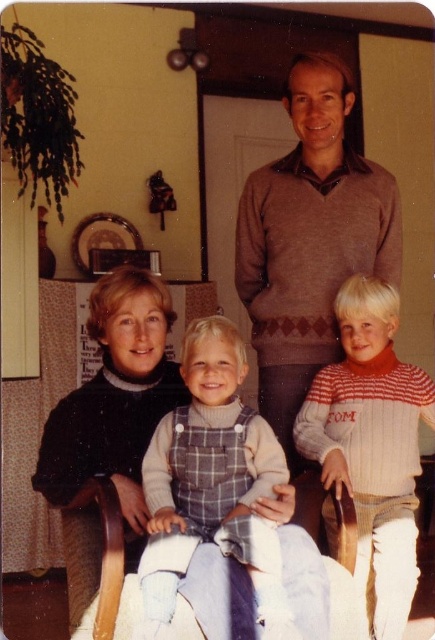
Is brown sweater at center below plaid denim overalls at center?

Incorrect, brown sweater at center is not positioned below plaid denim overalls at center.

Is brown sweater at center to the left of plaid denim overalls at center from the viewer's perspective?

In fact, brown sweater at center is to the right of plaid denim overalls at center.

I want to click on brown sweater at center, so click(310, 240).

Find the location of `brown sweater at center`. brown sweater at center is located at coordinates (x=310, y=240).

Which of these two, black sweater at center or wooden chair at center, stands taller?

black sweater at center is taller.

Who is lower down, black sweater at center or wooden chair at center?

wooden chair at center

The width and height of the screenshot is (435, 640). Find the location of `black sweater at center`. black sweater at center is located at coordinates (114, 397).

At what (x,y) coordinates should I click in order to perform the action: click on black sweater at center. Please return your answer as a coordinate pair (x, y). The width and height of the screenshot is (435, 640). Looking at the image, I should click on (114, 397).

From the picture: Is knitted sweater at right thinner than black sweater at center?

No.

Is point (400, 362) positioned behind point (170, 310)?

Yes, point (400, 362) is behind point (170, 310).

Who is more forward, (362, 326) or (97, 477)?

Positioned in front is point (97, 477).

Identify the location of knitted sweater at right. This screenshot has width=435, height=640. (371, 444).